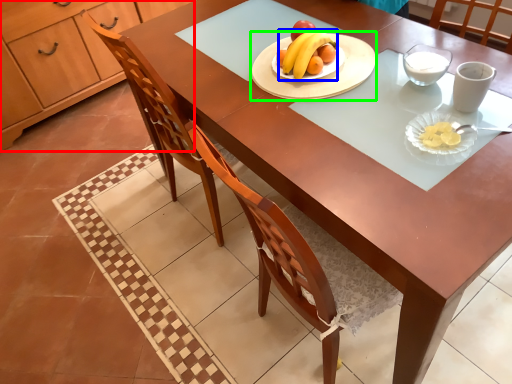
Question: Based on their relative distances, which object is farther from cabinetry (highlighted by a red box)? Choose from banana (highlighted by a blue box) and platter (highlighted by a green box).

Choices:
 (A) banana
 (B) platter

Answer: (A)